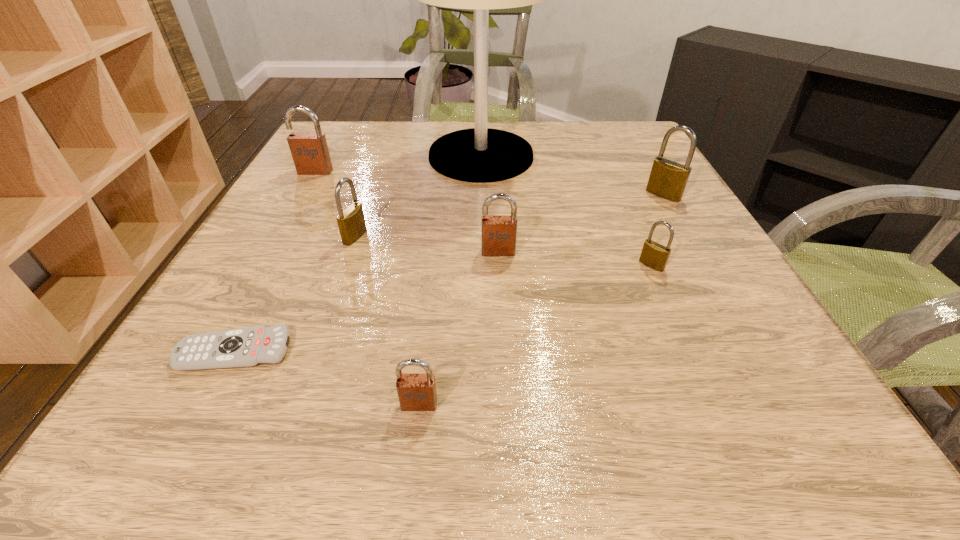
At what (x,y) coordinates should I click in order to perform the action: click on table lamp. Please return your answer as a coordinate pair (x, y). The height and width of the screenshot is (540, 960). Looking at the image, I should click on (479, 155).

At what (x,y) coordinates should I click in order to perform the action: click on beige table lamp. Please return your answer as a coordinate pair (x, y). This screenshot has height=540, width=960. Looking at the image, I should click on (479, 155).

Where is `the rightmost padlock`? the rightmost padlock is located at coordinates (668, 179).

Locate an element on the screen. The height and width of the screenshot is (540, 960). the biggest brass padlock is located at coordinates (668, 179).

The image size is (960, 540). Find the location of `the farthest brown padlock`. the farthest brown padlock is located at coordinates (309, 150).

Locate an element on the screen. the biggest brown padlock is located at coordinates (309, 150).

Image resolution: width=960 pixels, height=540 pixels. I want to click on the fourth farthest object, so click(351, 222).

Find the location of a particular element. Image resolution: width=960 pixels, height=540 pixels. the second padlock from left to right is located at coordinates (351, 222).

The width and height of the screenshot is (960, 540). Identify the location of the fifth farthest object. (499, 233).

Where is `the second biggest brown padlock`? The width and height of the screenshot is (960, 540). the second biggest brown padlock is located at coordinates [499, 233].